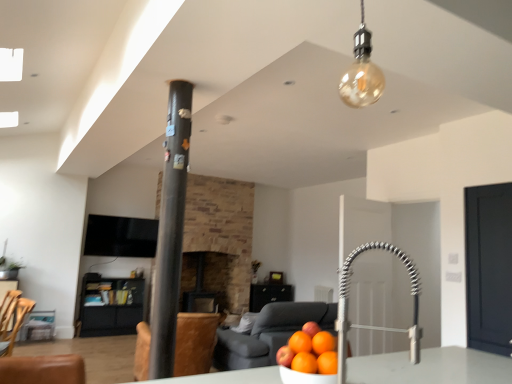
Describe the element at coordinates (207, 277) in the screenshot. I see `dark brown stone fireplace at center` at that location.

Based on the photo, measure the distance between point (226, 300) and camera.

5.91 meters.

Describe the element at coordinates (170, 231) in the screenshot. The height and width of the screenshot is (384, 512). I see `black textured pillar at center` at that location.

Locate an element on the screen. The height and width of the screenshot is (384, 512). dark matte door at right is located at coordinates (489, 267).

The height and width of the screenshot is (384, 512). I want to click on wooden swivel chair at lower left, which is counted as the 1th swivel chair, starting from the left, so click(15, 326).

You are a GUI agent. You are given a task and a screenshot of the screen. Output one action in this format:
    pyautogui.click(x=<x>, y=<y>)
    Task: Click on the orange matte bowl at center
    The width and height of the screenshot is (512, 384).
    Given the screenshot: What is the action you would take?
    pyautogui.click(x=310, y=351)

In order to click on dark brown stone fireplace at center in this screenshot , I will do `click(207, 277)`.

Locate an element on the screen. light fixture located on the right of brown leather swivel chair at center, which ranks as the 1th swivel chair in back-to-front order is located at coordinates (362, 72).

Considering the sizes of objects brown leather swivel chair at center, positioned as the second swivel chair in left-to-right order, and amber glass bulb at upper center in the image provided, who is smaller, brown leather swivel chair at center, positioned as the second swivel chair in left-to-right order, or amber glass bulb at upper center?

amber glass bulb at upper center.

From the image's perspective, is brown leather swivel chair at center, which is counted as the 2th swivel chair, starting from the front, on top of amber glass bulb at upper center?

No, from the image's perspective, brown leather swivel chair at center, which is counted as the 2th swivel chair, starting from the front, is not over amber glass bulb at upper center.

Is brown leather swivel chair at center, which is counted as the 1th swivel chair, starting from the right, wider or thinner than amber glass bulb at upper center?

Considering their sizes, brown leather swivel chair at center, which is counted as the 1th swivel chair, starting from the right, looks broader than amber glass bulb at upper center.

In the image, is dark matte door at right on the left side or the right side of brown leather swivel chair at center, positioned as the second swivel chair in left-to-right order?

Clearly, dark matte door at right is on the right of brown leather swivel chair at center, positioned as the second swivel chair in left-to-right order, in the image.

Can brown leather swivel chair at center, which is counted as the 1th swivel chair, starting from the right, be found inside dark matte door at right?

No, brown leather swivel chair at center, which is counted as the 1th swivel chair, starting from the right, is not a part of dark matte door at right.

Consider the image. Which point is more forward, (470,211) or (181,361)?

The point (470,211) is more forward.

Which object is further away from the camera, dark matte door at right or brown leather swivel chair at center, positioned as the second swivel chair in left-to-right order?

brown leather swivel chair at center, positioned as the second swivel chair in left-to-right order, is further from the camera.

Does black matte cabinet at lower left have a larger size compared to black textured pillar at center?

Correct, black matte cabinet at lower left is larger in size than black textured pillar at center.

Looking at this image, which is closer to the camera, (100, 289) or (169, 85)?

The point (169, 85) is in front.

Is black matte cabinet at lower left to the left or to the right of black textured pillar at center in the image?

Clearly, black matte cabinet at lower left is on the left of black textured pillar at center in the image.

Locate an element on the screen. The width and height of the screenshot is (512, 384). glass door below the orange matte bowl at center (from the image's perspective) is located at coordinates (489, 267).

From the image's perspective, which is above, dark matte door at right or orange matte bowl at center?

orange matte bowl at center.

From the picture: Does dark matte door at right appear on the right side of orange matte bowl at center?

Correct, you'll find dark matte door at right to the right of orange matte bowl at center.

Is point (474, 284) positioned behind point (304, 337)?

Yes, point (474, 284) is farther from viewer.

Is black matte cabinet at lower left inside or outside of dark brown stone fireplace at center?

black matte cabinet at lower left is outside dark brown stone fireplace at center.

Looking at this image, can you confirm if black matte cabinet at lower left is bigger than dark brown stone fireplace at center?

Indeed, black matte cabinet at lower left has a larger size compared to dark brown stone fireplace at center.

Which is more to the left, black matte cabinet at lower left or dark brown stone fireplace at center?

From the viewer's perspective, black matte cabinet at lower left appears more on the left side.

Which is more to the right, orange matte bowl at center or satin nickel faucet at center?

From the viewer's perspective, satin nickel faucet at center appears more on the right side.

Which object is more forward, orange matte bowl at center or satin nickel faucet at center?

satin nickel faucet at center is closer to the camera.

Is orange matte bowl at center touching satin nickel faucet at center?

There is a gap between orange matte bowl at center and satin nickel faucet at center.

From a real-world perspective, is orange matte bowl at center under satin nickel faucet at center?

Correct, in the physical world, orange matte bowl at center is lower than satin nickel faucet at center.

Based on the photo, from a real-world perspective, relative to orange matte bowl at center, is dark brown stone fireplace at center vertically above or below?

Clearly, from a real-world perspective, dark brown stone fireplace at center is below orange matte bowl at center.

Relative to orange matte bowl at center, is dark brown stone fireplace at center in front or behind?

Clearly, dark brown stone fireplace at center is behind orange matte bowl at center.

Is dark brown stone fireplace at center in contact with orange matte bowl at center?

No.

Which of these two, dark brown stone fireplace at center or orange matte bowl at center, stands taller?

With more height is dark brown stone fireplace at center.

Identify the location of light fixture that appears above the brown leather swivel chair at center, which is counted as the 1th swivel chair, starting from the right (from the image's perspective). This screenshot has width=512, height=384. (362, 72).

Image resolution: width=512 pixels, height=384 pixels. I want to click on the 2nd swivel chair located beneath the dark matte door at right (from a real-world perspective), so click(195, 342).

Considering their positions, is wooden swivel chair at lower left, which is the 2th swivel chair in back-to-front order, positioned closer to dark matte door at right than amber glass bulb at upper center?

amber glass bulb at upper center.

Based on their spatial positions, is black matte cabinet at lower left or wooden swivel chair at lower left, which is counted as the 1th swivel chair, starting from the left, closer to amber glass bulb at upper center?

wooden swivel chair at lower left, which is counted as the 1th swivel chair, starting from the left, is positioned closer to the anchor amber glass bulb at upper center.

From the image, which object appears to be farther from black matte cabinet at lower left, brown leather swivel chair at center, which ranks as the 1th swivel chair in back-to-front order, or dark matte door at right?

Among the two, dark matte door at right is located further to black matte cabinet at lower left.

Considering their positions, is black matte cabinet at lower left positioned closer to amber glass bulb at upper center than orange matte bowl at center?

orange matte bowl at center lies closer to amber glass bulb at upper center than the other object.

Which object lies nearer to the anchor point black matte cabinet at lower left, satin nickel faucet at center or orange matte bowl at center?

→ The object closer to black matte cabinet at lower left is orange matte bowl at center.

When comparing their distances from dark matte door at right, does black matte cabinet at lower left or black textured pillar at center seem closer?

Based on the image, black textured pillar at center appears to be nearer to dark matte door at right.

Estimate the real-world distances between objects in this image. Which object is closer to satin nickel faucet at center, orange matte bowl at center or dark brown stone fireplace at center?

orange matte bowl at center lies closer to satin nickel faucet at center than the other object.

Estimate the real-world distances between objects in this image. Which object is closer to orange matte bowl at center, black matte cabinet at lower left or dark matte door at right?

dark matte door at right lies closer to orange matte bowl at center than the other object.

Identify the location of orange between satin nickel faucet at center and dark brown stone fireplace at center along the z-axis. Image resolution: width=512 pixels, height=384 pixels. (310, 351).

Where is `pillar situated between wooden swivel chair at lower left, the 2th swivel chair viewed from the right, and dark matte door at right from left to right`? This screenshot has width=512, height=384. pillar situated between wooden swivel chair at lower left, the 2th swivel chair viewed from the right, and dark matte door at right from left to right is located at coordinates (170, 231).

The width and height of the screenshot is (512, 384). Identify the location of glass door positioned between black textured pillar at center and black matte cabinet at lower left from near to far. 489,267.

Locate an element on the screen. pillar located between brown leather swivel chair at center, which is counted as the 2th swivel chair, starting from the front, and dark matte door at right in the left-right direction is located at coordinates (170, 231).